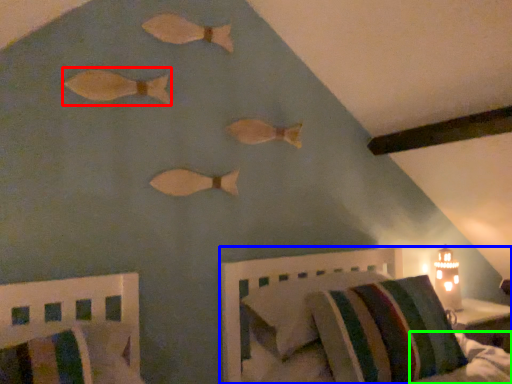
Question: Which object is the closest to the animal (highlighted by a red box)? Choose among these: furniture (highlighted by a blue box) or mattress (highlighted by a green box).

Choices:
 (A) furniture
 (B) mattress

Answer: (A)